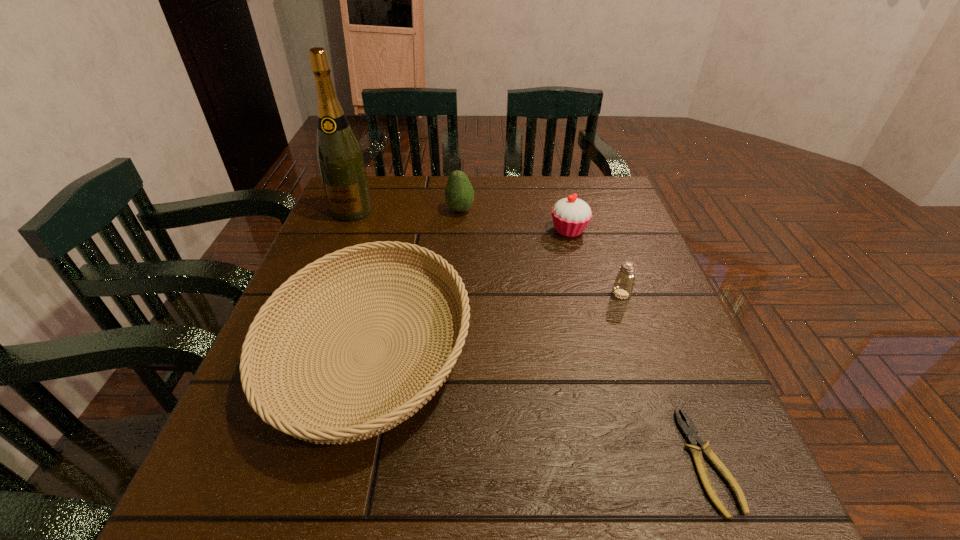
This screenshot has height=540, width=960. Identify the location of the fourth closest object relative to the fourth object from left to right. (339, 156).

Identify the location of the third closest object to the basket. The image size is (960, 540). (571, 215).

Locate an element on the screen. Image resolution: width=960 pixels, height=540 pixels. vacant region that satisfies the following two spatial constraints: 1. on the front-facing side of the tallest object; 2. on the left side of the pliers is located at coordinates (251, 461).

At what (x,y) coordinates should I click in order to perform the action: click on vacant area in the image that satisfies the following two spatial constraints: 1. on the back side of the avocado; 2. on the left side of the basket. Please return your answer as a coordinate pair (x, y). The width and height of the screenshot is (960, 540). Looking at the image, I should click on (403, 211).